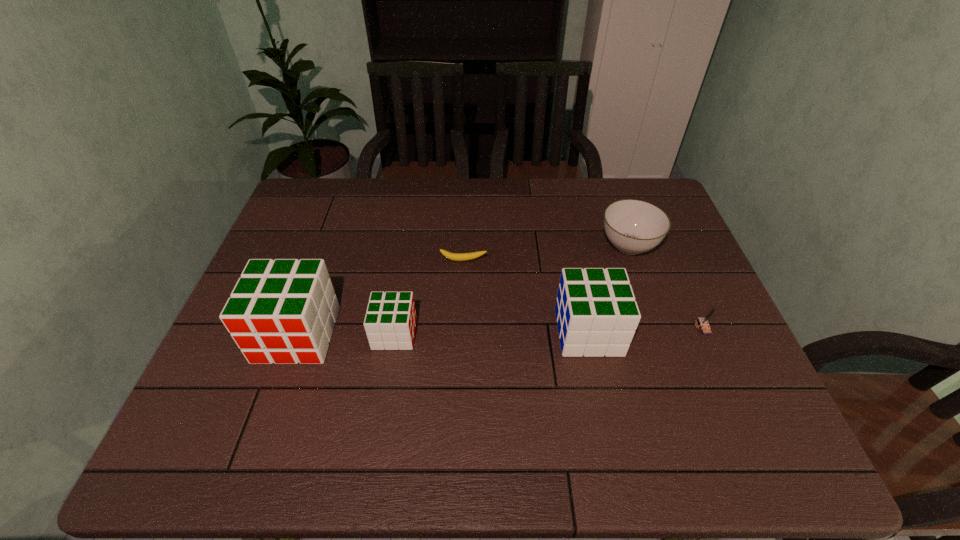
At what (x,y) coordinates should I click in order to perform the action: click on free space located 0.150m on the red face of the shortest cube. Please return your answer as a coordinate pair (x, y). This screenshot has width=960, height=540. Looking at the image, I should click on (476, 334).

What are the coordinates of `vacant region located 0.140m on the red face of the rightmost cube` in the screenshot? It's located at [x=676, y=332].

Find the location of a particular element. The width and height of the screenshot is (960, 540). vacant space located 0.070m on the front of the fifth object from left to right is located at coordinates (642, 285).

The height and width of the screenshot is (540, 960). In order to click on vacant space located on the back of the matchbox in this screenshot , I will do `click(660, 230)`.

Locate an element on the screen. vacant space located 0.100m on the upward curve of the fourth object from right to left is located at coordinates (462, 289).

The height and width of the screenshot is (540, 960). What are the coordinates of `object situated at the left edge` in the screenshot? It's located at (283, 311).

Image resolution: width=960 pixels, height=540 pixels. I want to click on chinaware at the right edge, so click(632, 226).

What are the coordinates of `matchbox at the right edge` in the screenshot? It's located at (703, 322).

Find the location of a particular element. This screenshot has height=540, width=960. vacant position at the far edge of the desktop is located at coordinates (507, 215).

The width and height of the screenshot is (960, 540). Find the location of `free region at the near edge of the desktop`. free region at the near edge of the desktop is located at coordinates (272, 413).